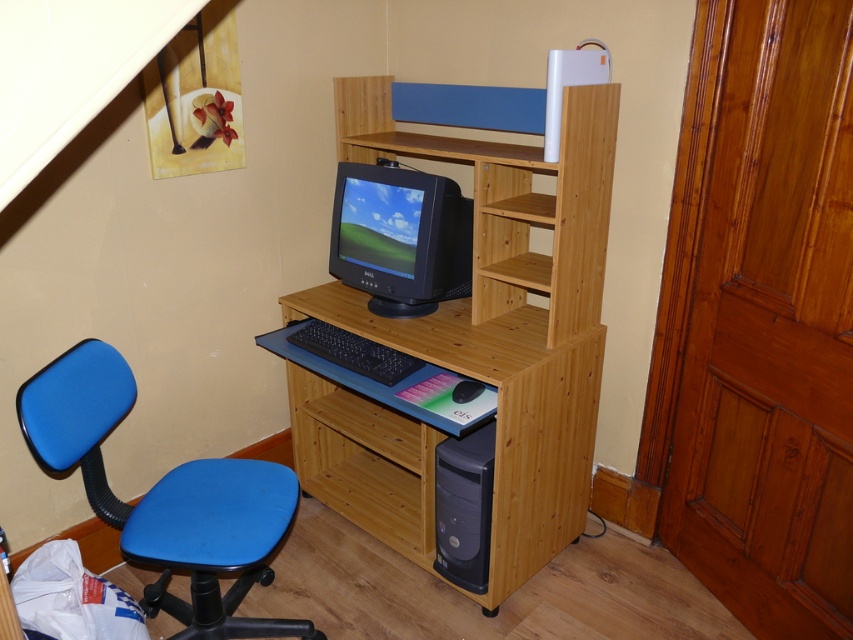
Who is more distant from viewer, [469,577] or [329,358]?

Point [329,358]

Can you confirm if black plastic computer at lower right is positioned below black plastic keyboard at center?

Result: Correct, black plastic computer at lower right is located below black plastic keyboard at center.

Which is in front, point (485, 544) or point (379, 371)?

Point (485, 544) is in front.

Where is `black plastic computer at lower right`? Image resolution: width=853 pixels, height=640 pixels. black plastic computer at lower right is located at coordinates click(x=463, y=508).

Which is more to the right, natural wood computer desk at center or natural wood shelf at center?

From the viewer's perspective, natural wood shelf at center appears more on the right side.

Is natural wood computer desk at center to the left of natural wood shelf at center from the viewer's perspective?

Yes, natural wood computer desk at center is to the left of natural wood shelf at center.

Identify the location of natural wood computer desk at center. This screenshot has height=640, width=853. (505, 305).

Who is taller, natural wood computer desk at center or matte black monitor at center?

natural wood computer desk at center is taller.

The image size is (853, 640). I want to click on natural wood computer desk at center, so click(505, 305).

Where is `natural wood computer desk at center`? natural wood computer desk at center is located at coordinates (505, 305).